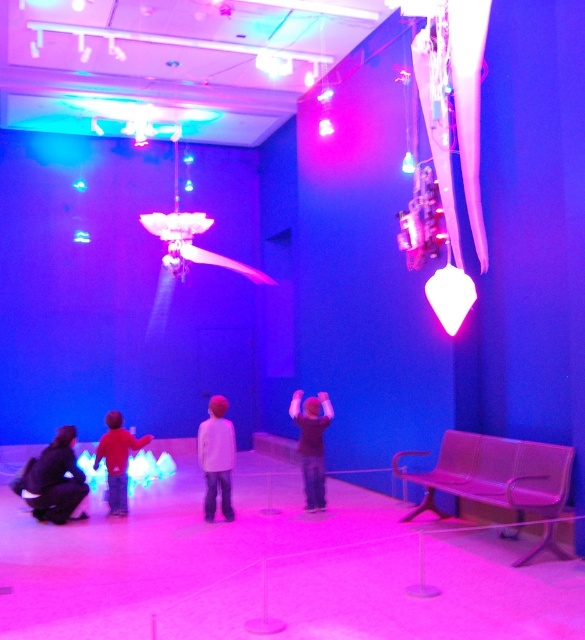
How far apart are white matte shirt at center and black matte shirt at center?

36.77 inches

Is white matte shirt at center closer to the viewer compared to black matte shirt at center?

Yes, white matte shirt at center is in front of black matte shirt at center.

Does point (215, 474) lie behind point (309, 458)?

No, it is in front of (309, 458).

This screenshot has height=640, width=585. Identify the location of white matte shirt at center. (216, 458).

Is dark gray fabric at lower left smaller than red cotton shirt at lower left?

Correct, dark gray fabric at lower left occupies less space than red cotton shirt at lower left.

This screenshot has height=640, width=585. In order to click on dark gray fabric at lower left in this screenshot , I will do `click(54, 480)`.

Where is `dark gray fabric at lower left`? The width and height of the screenshot is (585, 640). dark gray fabric at lower left is located at coordinates (54, 480).

Can you confirm if dark gray fabric at lower left is smaller than white matte shirt at center?

No, dark gray fabric at lower left is not smaller than white matte shirt at center.

Locate an element on the screen. Image resolution: width=585 pixels, height=640 pixels. dark gray fabric at lower left is located at coordinates (54, 480).